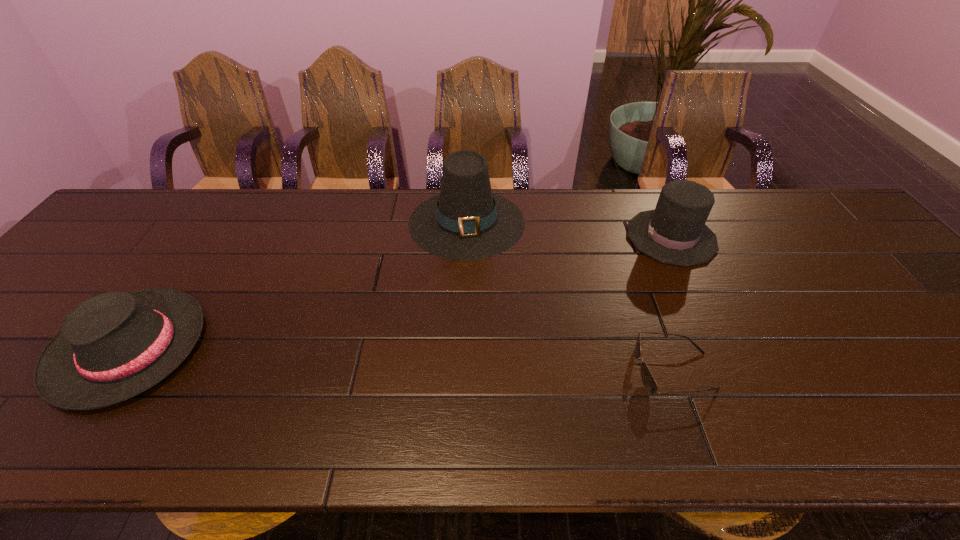
At what (x,y) coordinates should I click in order to perform the action: click on the tallest object. Please return your answer as a coordinate pair (x, y). Looking at the image, I should click on (466, 221).

Where is `the tallest dress hat`? the tallest dress hat is located at coordinates (466, 221).

You are a GUI agent. You are given a task and a screenshot of the screen. Output one action in this format:
    pyautogui.click(x=<x>, y=<y>)
    Task: Click on the third shortest object
    The width and height of the screenshot is (960, 540).
    Given the screenshot: What is the action you would take?
    pyautogui.click(x=675, y=233)

At what (x,y) coordinates should I click in order to perform the action: click on the rightmost dress hat. Please return your answer as a coordinate pair (x, y). Looking at the image, I should click on (675, 233).

Find the location of a particular element. the second shortest object is located at coordinates (113, 346).

Where is `the leftmost dress hat`? The width and height of the screenshot is (960, 540). the leftmost dress hat is located at coordinates (113, 346).

Locate an element on the screen. This screenshot has height=540, width=960. the shortest object is located at coordinates (647, 378).

You are a GUI agent. You are given a task and a screenshot of the screen. Output one action in this format:
    pyautogui.click(x=<x>, y=<y>)
    Task: Click on the free space located 0.190m on the front-facing side of the tallest object
    This screenshot has height=540, width=960.
    Given the screenshot: What is the action you would take?
    pyautogui.click(x=464, y=314)

You are a GUI agent. You are given a task and a screenshot of the screen. Output one action in this format:
    pyautogui.click(x=<x>, y=<y>)
    Task: Click on the free region located on the front of the second tallest dress hat with the decoration
    The image size is (960, 540).
    Given the screenshot: What is the action you would take?
    pyautogui.click(x=603, y=238)

Find the location of a particular element. vacant region located on the front of the second tallest dress hat with the decoration is located at coordinates (554, 238).